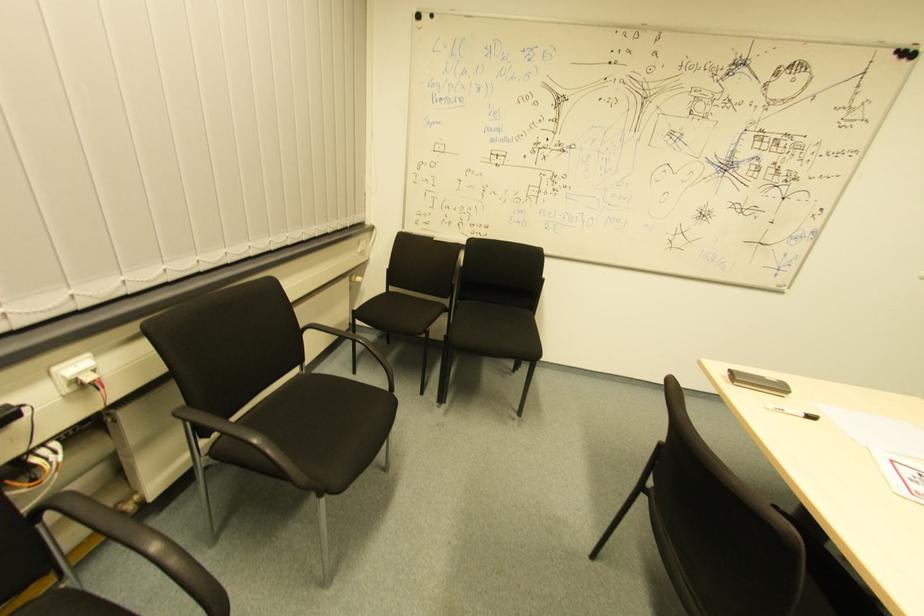
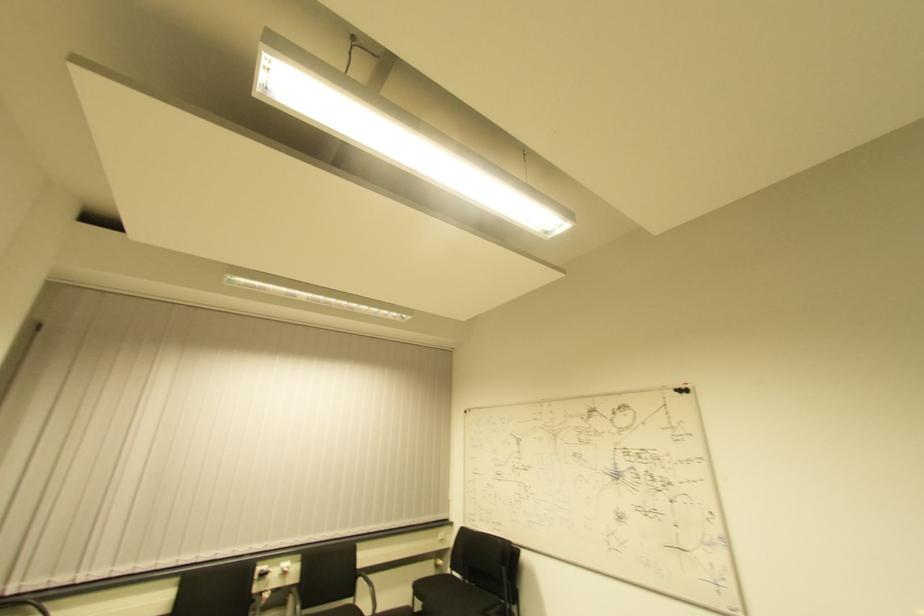
In the second image, find the point that corresponds to (371,231) in the first image.

(450, 527)